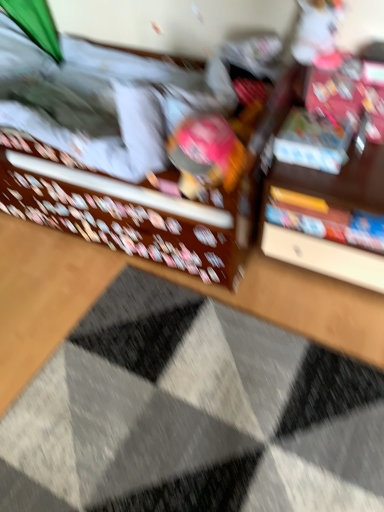
Question: Can you confirm if textured gray doormat at center is bigger than matte plastic toy at center?

Choices:
 (A) no
 (B) yes

Answer: (B)

Question: Can matte plastic toy at center be found inside textured gray doormat at center?

Choices:
 (A) yes
 (B) no

Answer: (B)

Question: From the image's perspective, is textured gray doormat at center below matte plastic toy at center?

Choices:
 (A) yes
 (B) no

Answer: (A)

Question: Is textured gray doormat at center shorter than matte plastic toy at center?

Choices:
 (A) no
 (B) yes

Answer: (B)

Question: From a real-world perspective, is textured gray doormat at center located beneath matte plastic toy at center?

Choices:
 (A) yes
 (B) no

Answer: (A)

Question: Does textured gray doormat at center come behind matte plastic toy at center?

Choices:
 (A) yes
 (B) no

Answer: (B)

Question: From the image's perspective, does matte plastic book at upper right, placed as the 2th book when sorted from bottom to top, appear lower than matte plastic toy at center?

Choices:
 (A) no
 (B) yes

Answer: (A)

Question: From the image's perspective, is matte plastic book at upper right, placed as the 2th book when sorted from bottom to top, over matte plastic toy at center?

Choices:
 (A) no
 (B) yes

Answer: (B)

Question: Is matte plastic book at upper right, which is the first book from top to bottom, in contact with matte plastic toy at center?

Choices:
 (A) yes
 (B) no

Answer: (B)

Question: Is matte plastic toy at center completely or partially inside matte plastic book at upper right, placed as the 2th book when sorted from bottom to top?

Choices:
 (A) yes
 (B) no

Answer: (B)

Question: Considering the relative sizes of matte plastic book at upper right, which is the first book from top to bottom, and matte plastic toy at center in the image provided, is matte plastic book at upper right, which is the first book from top to bottom, wider than matte plastic toy at center?

Choices:
 (A) yes
 (B) no

Answer: (B)

Question: Considering the relative sizes of matte plastic book at upper right, which is the first book from top to bottom, and matte plastic toy at center in the image provided, is matte plastic book at upper right, which is the first book from top to bottom, shorter than matte plastic toy at center?

Choices:
 (A) yes
 (B) no

Answer: (A)

Question: From the image's perspective, is matte plastic book at upper right, placed as the 2th book when sorted from bottom to top, on top of hardcover book at center, the 1th book positioned from the bottom?

Choices:
 (A) yes
 (B) no

Answer: (A)